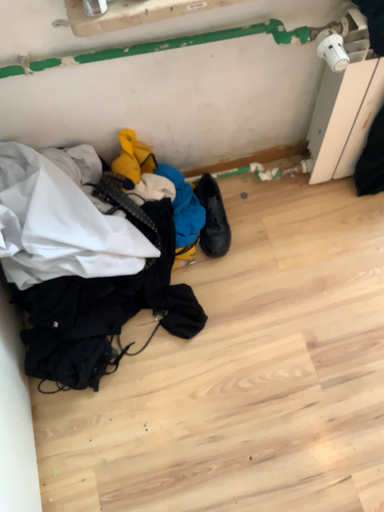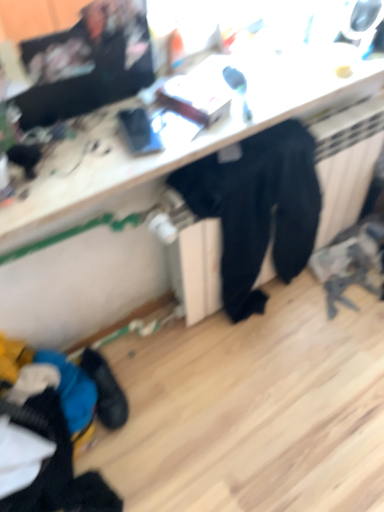
Question: How did the camera likely rotate when shooting the video?

Choices:
 (A) rotated upward
 (B) rotated downward

Answer: (A)